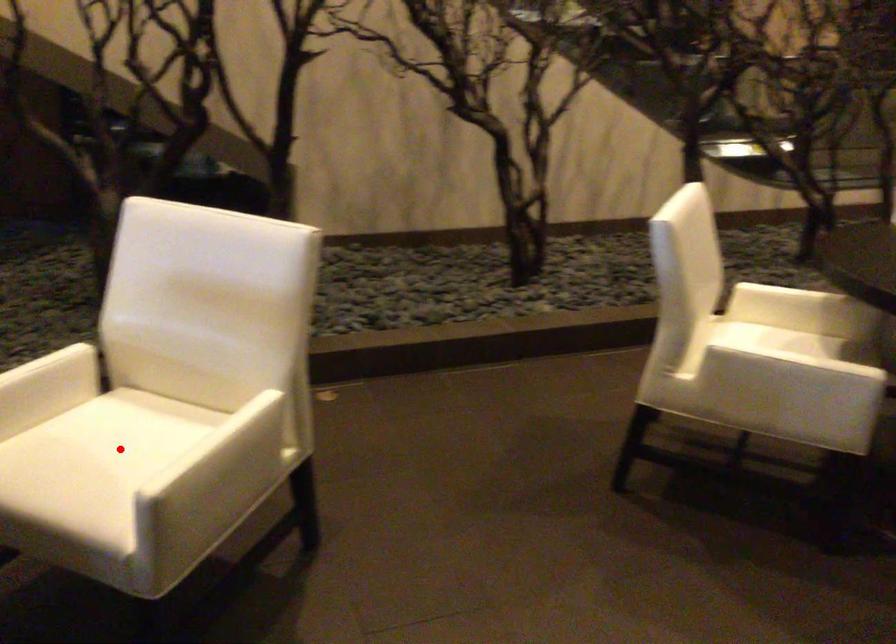
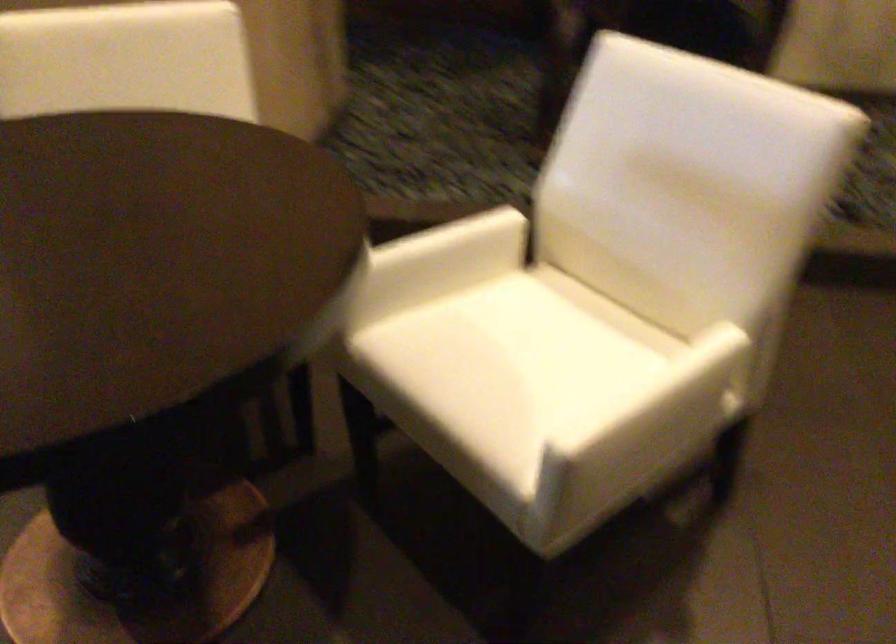
Find the pixel in the second image that matches the highlighted location in the first image.

(533, 348)